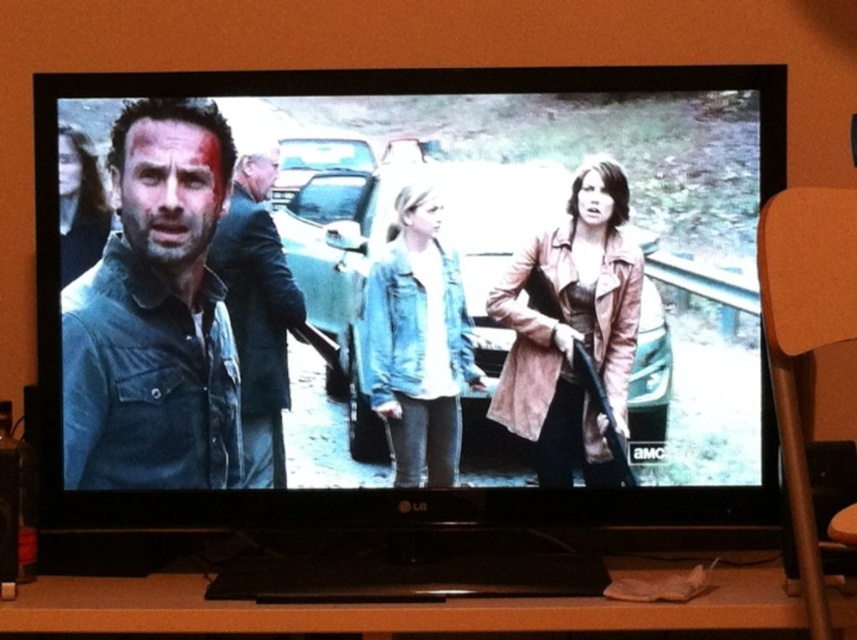
Question: Is dark blue denim shirt at left to the right of leather jacket at right from the viewer's perspective?

Choices:
 (A) yes
 (B) no

Answer: (B)

Question: Which object is the farthest from the denim jacket at left?

Choices:
 (A) denim jacket at center
 (B) matte black jacket at center

Answer: (A)

Question: Among these points, which one is nearest to the camera?

Choices:
 (A) (758, 580)
 (B) (87, 218)
 (C) (273, 328)

Answer: (A)

Question: Does wooden entertainment center at lower center appear on the right side of matte black shirt at left?

Choices:
 (A) no
 (B) yes

Answer: (B)

Question: Can you confirm if wooden entertainment center at lower center is bigger than leather jacket at right?

Choices:
 (A) no
 (B) yes

Answer: (B)

Question: Which object appears closest to the camera in this image?

Choices:
 (A) dark blue denim shirt at left
 (B) matte black shirt at left

Answer: (A)